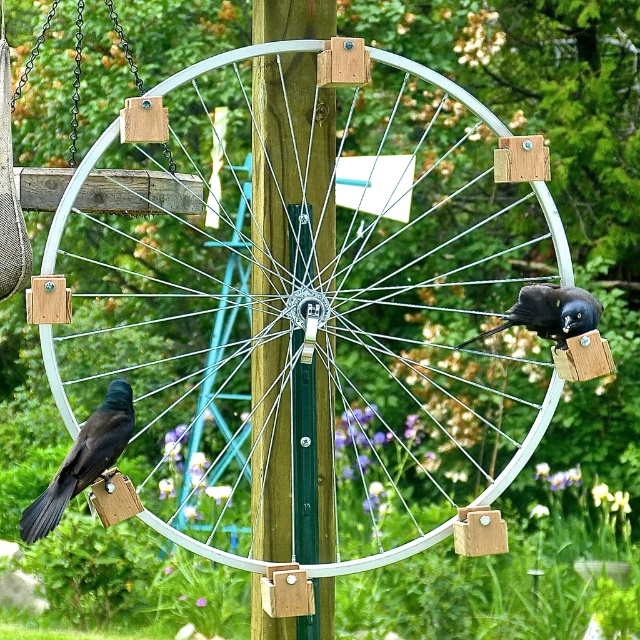
You are a bird trying to land on the green wood pole at center. There is a shiny black bird at left already perched there. Considering the size difference between the two, will you have enough space to land?

The green wood pole at center has a larger size compared to the shiny black bird at left, so there should be enough space for another bird to land.

You are a bird watcher observing the scene. You notice the shiny black bird at left and the white metallic wagon wheel at center. Which object is closer to you, the observer?

The shiny black bird at left is behind the white metallic wagon wheel at center, so the white metallic wagon wheel at center is closer to you.